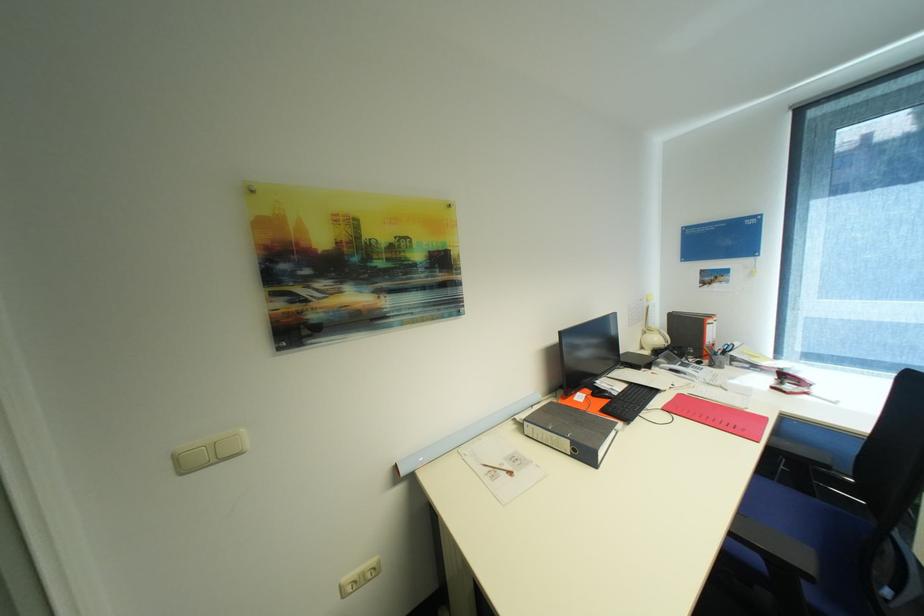
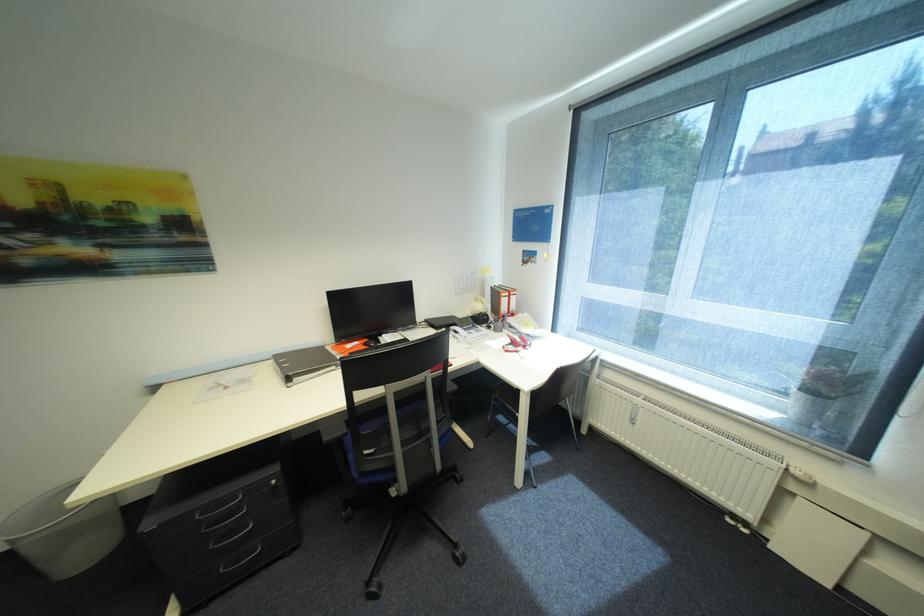
Locate, in the second image, the point that corresponds to [750,369] in the first image.

(521, 333)